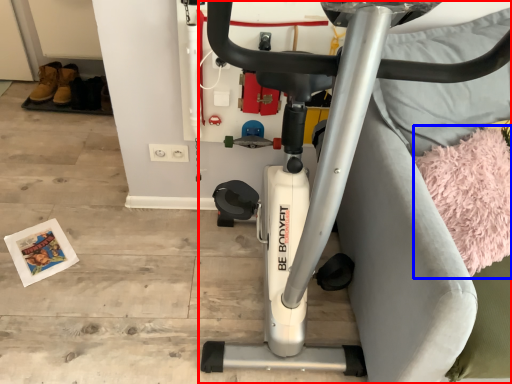
Question: Among these objects, which one is farthest to the camera, stationary bicycle (highlighted by a red box) or yoga mat (highlighted by a blue box)?

Choices:
 (A) stationary bicycle
 (B) yoga mat

Answer: (B)